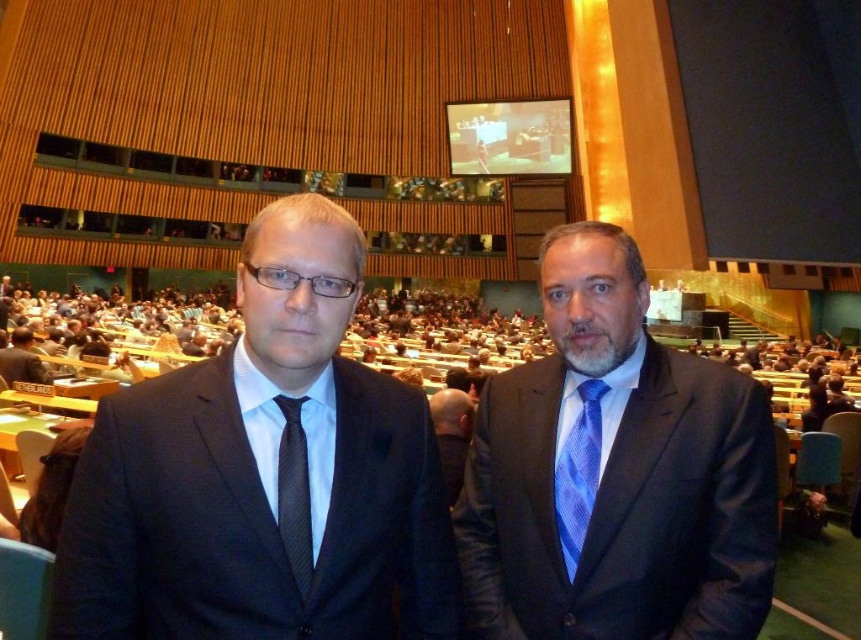
You are an event organizer who needs to adjust the seating arrangement. You notice the matte black suit at center and the blue silk tie at center. Which object is positioned closer to the front of the hall?

The matte black suit at center is closer to the viewer than the blue silk tie at center, so the matte black suit at center is positioned closer to the front of the hall.

You are a photographer at the event and want to capture a clear photo of both the blue striped tie at center and the blue silk tie at center. Which tie will appear larger in the photo?

The blue striped tie at center will appear larger in the photo because it is closer to the viewer than the blue silk tie at center.

You are standing at the back of the conference hall and want to take a photo. There are two points in the image labeled as point (581, 262) and point (438, 404). Which point will appear closer to you in the photo?

Point (581, 262) is closer to the camera than point (438, 404), so it will appear closer to you in the photo.